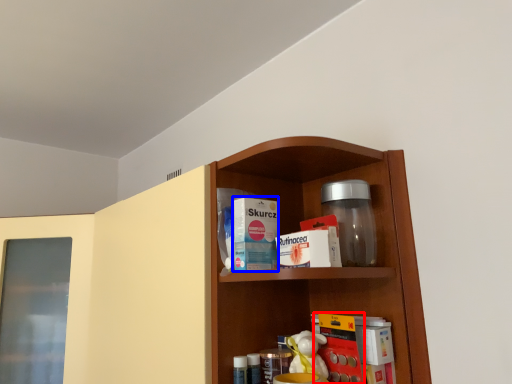
Question: Which object appears farthest to the camera in this image, book (highlighted by a red box) or product (highlighted by a blue box)?

Choices:
 (A) book
 (B) product

Answer: (B)